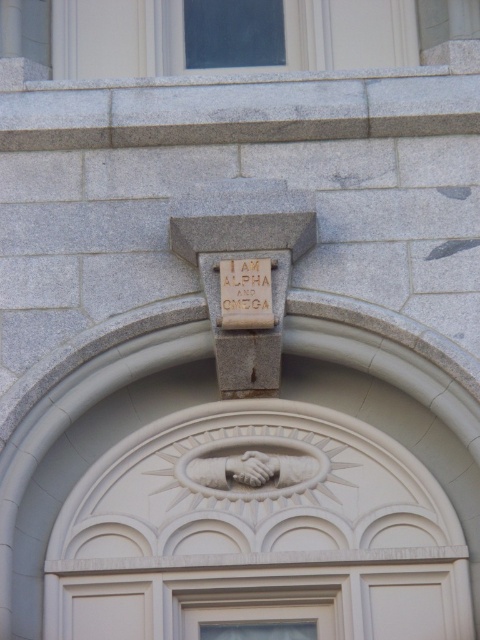
Is white painted wood door at center behind red stone inscription at center?

No, white painted wood door at center is closer to the viewer.

Image resolution: width=480 pixels, height=640 pixels. Find the location of `white painted wood door at center`. white painted wood door at center is located at coordinates (264, 600).